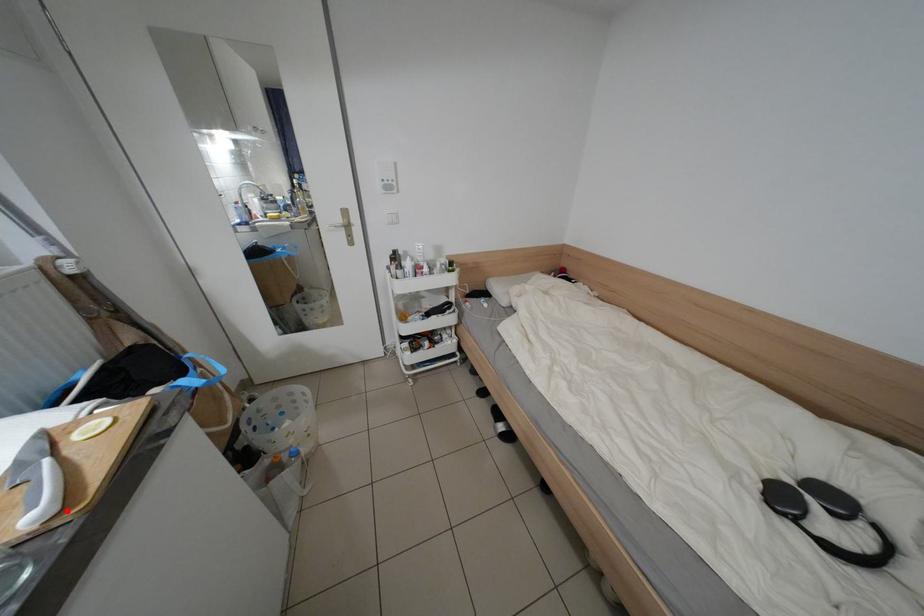
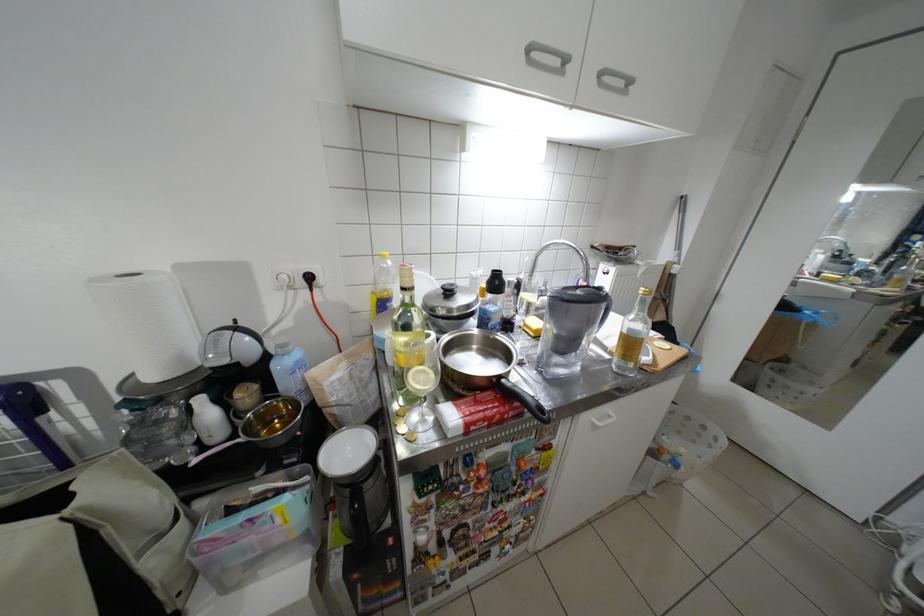
Where in the second image is the point corresponding to the highlighted location from the first image?

(662, 363)